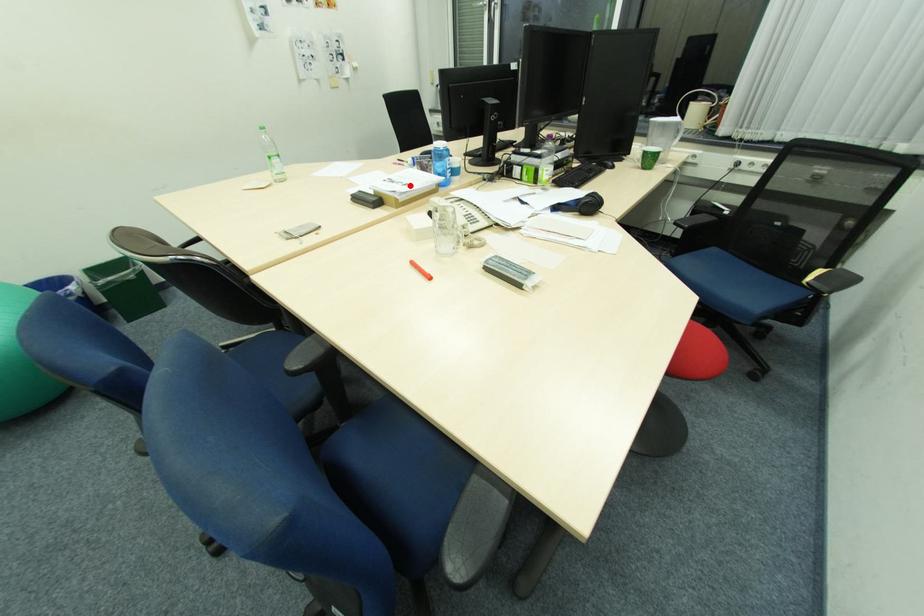
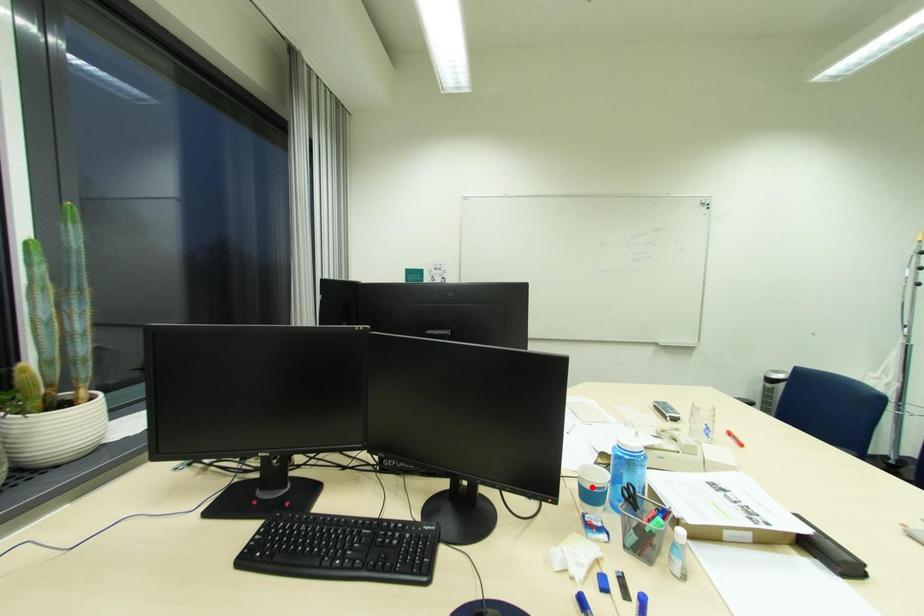
I am providing you with two images of the same scene from different viewpoints. A red point is marked on the first image and another point is marked on the second image. Are the points marked in image1 and image2 representing the same 3D position?

No